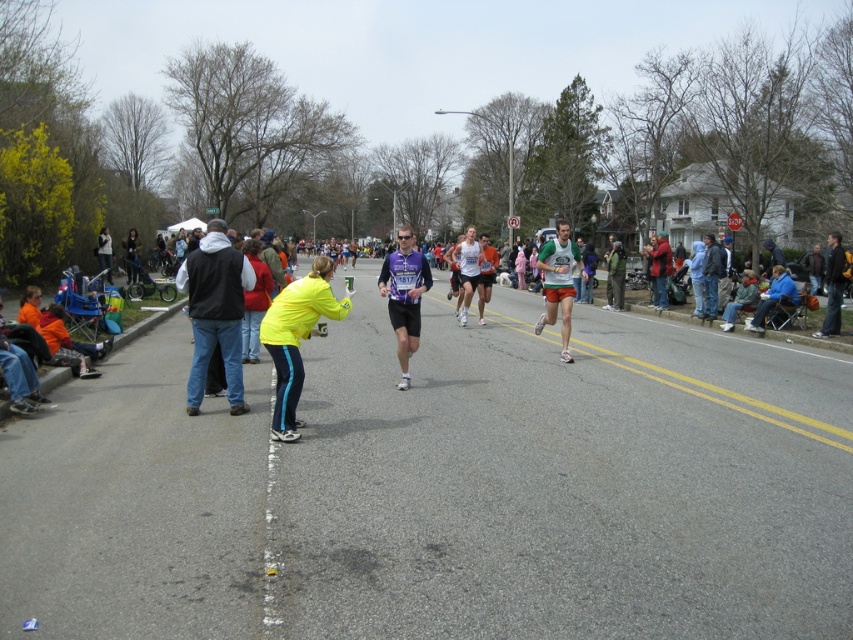
Which is above, green fabric shorts at center or white running outfit at center?

white running outfit at center

In the scene shown: Is green fabric shorts at center smaller than white running outfit at center?

No, green fabric shorts at center is not smaller than white running outfit at center.

Which is in front, point (567, 308) or point (480, 294)?

Point (567, 308)

I want to click on green fabric shorts at center, so click(558, 282).

Does neon yellow jacket at lower left have a lesser height compared to matte black jacket at center?

Correct, neon yellow jacket at lower left is not as tall as matte black jacket at center.

You are a GUI agent. You are given a task and a screenshot of the screen. Output one action in this format:
    pyautogui.click(x=<x>, y=<y>)
    Task: Click on the neon yellow jacket at lower left
    The width and height of the screenshot is (853, 640).
    Given the screenshot: What is the action you would take?
    tap(296, 337)

Locate an element on the screen. This screenshot has width=853, height=640. neon yellow jacket at lower left is located at coordinates (296, 337).

How much distance is there between black vest at center and white running outfit at center?

A distance of 8.06 meters exists between black vest at center and white running outfit at center.

From the picture: Which is more to the right, black vest at center or white running outfit at center?

Positioned to the right is white running outfit at center.

What do you see at coordinates (215, 310) in the screenshot? This screenshot has width=853, height=640. I see `black vest at center` at bounding box center [215, 310].

This screenshot has width=853, height=640. I want to click on black vest at center, so click(x=215, y=310).